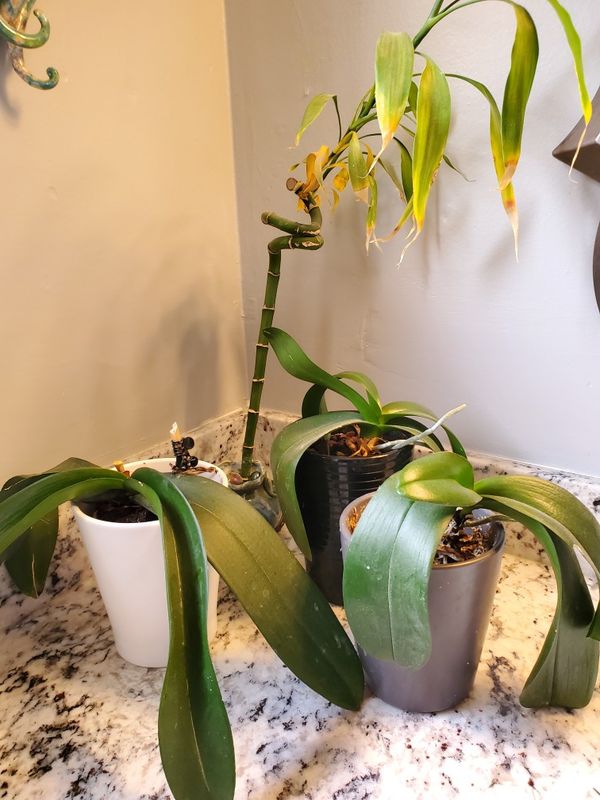
This screenshot has width=600, height=800. Find the location of `pots`. pots is located at coordinates (121, 577), (333, 500), (449, 602).